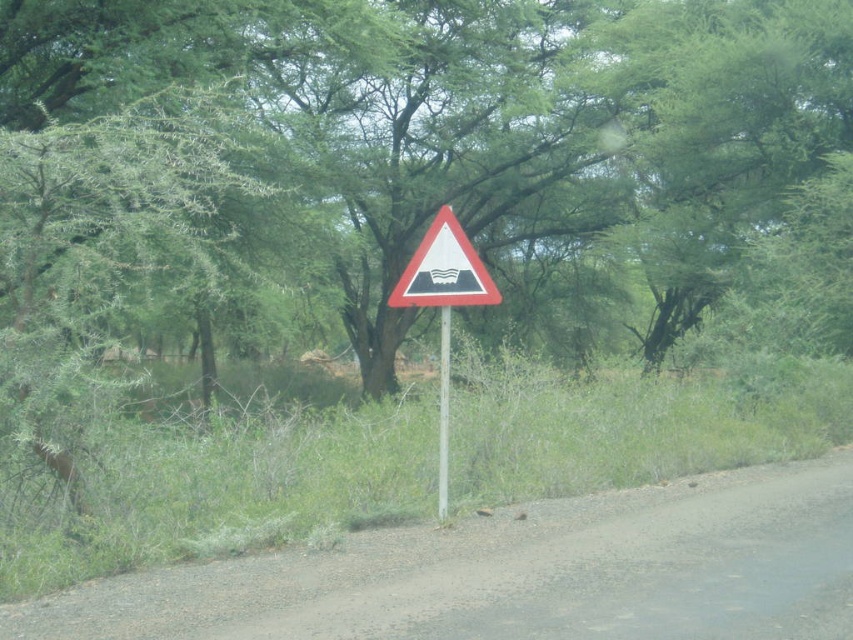
Question: Is the position of white plastic triangle at center less distant than that of white plastic pole at center?

Choices:
 (A) no
 (B) yes

Answer: (B)

Question: Which of the following is the farthest from the observer?

Choices:
 (A) (x=444, y=467)
 (B) (x=453, y=220)
 (C) (x=457, y=275)

Answer: (A)

Question: Is red plastic triangle at center bigger than white plastic pole at center?

Choices:
 (A) yes
 (B) no

Answer: (A)

Question: From the image, what is the correct spatial relationship of white plastic triangle at center in relation to white plastic pole at center?

Choices:
 (A) above
 (B) below

Answer: (A)

Question: Which point is closer to the camera?

Choices:
 (A) (447, 211)
 (B) (469, 298)

Answer: (B)

Question: Considering the real-world distances, which object is closest to the red plastic triangle at center?

Choices:
 (A) white plastic triangle at center
 (B) white plastic pole at center

Answer: (B)